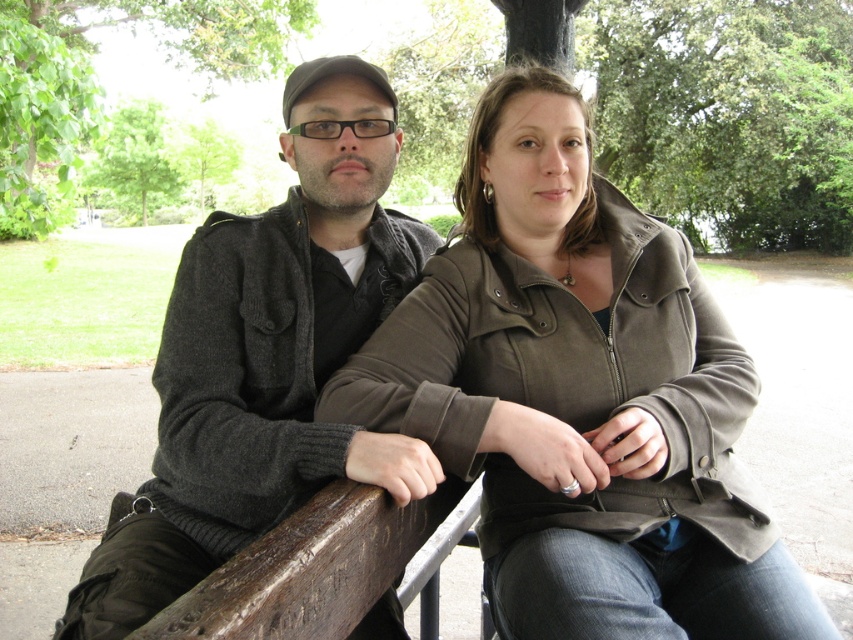
Question: Does matte olive green jacket at center appear on the left side of dark gray sweater at center?

Choices:
 (A) yes
 (B) no

Answer: (B)

Question: Which of the following is the closest to the observer?

Choices:
 (A) dark gray sweater at center
 (B) matte olive green jacket at center

Answer: (B)

Question: Does matte olive green jacket at center appear under dark gray sweater at center?

Choices:
 (A) no
 (B) yes

Answer: (A)

Question: Is matte olive green jacket at center thinner than dark gray sweater at center?

Choices:
 (A) no
 (B) yes

Answer: (B)